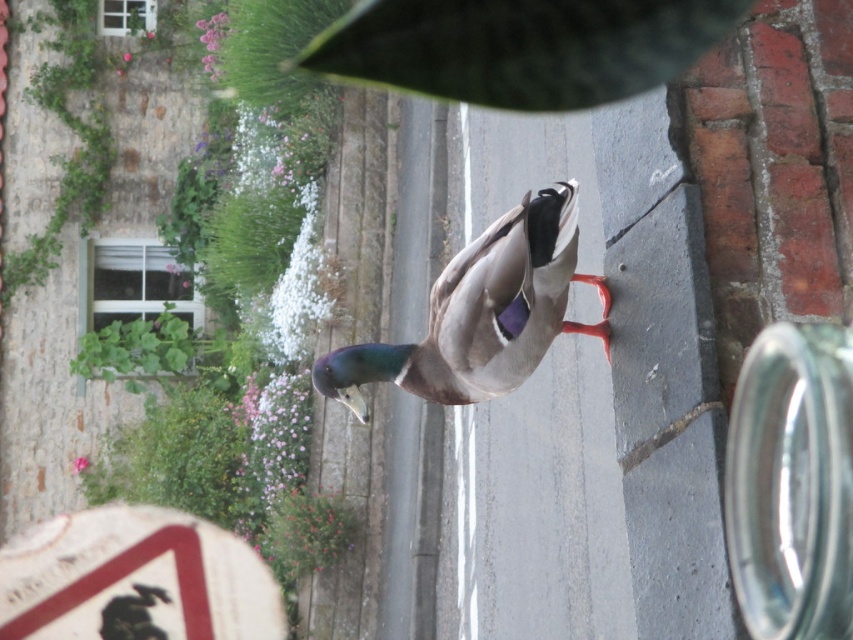
Question: Which point appears farthest from the camera in this image?

Choices:
 (A) (x=109, y=349)
 (B) (x=506, y=212)

Answer: (A)

Question: Is shiny brown duck at center thinner than green leafy plant at upper left?

Choices:
 (A) no
 (B) yes

Answer: (B)

Question: Which point is farther to the camera?

Choices:
 (A) green leafy plant at upper left
 (B) shiny brown duck at center

Answer: (A)

Question: Can you confirm if shiny brown duck at center is positioned below green leafy plant at upper left?

Choices:
 (A) yes
 (B) no

Answer: (B)

Question: Is shiny brown duck at center above green leafy plant at upper left?

Choices:
 (A) yes
 (B) no

Answer: (A)

Question: Which point is closer to the camera?

Choices:
 (A) shiny brown duck at center
 (B) green leafy plant at upper left

Answer: (A)